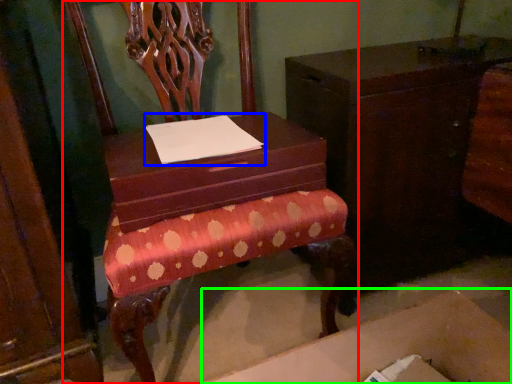
Question: Considering the real-world distances, which object is farthest from chair (highlighted by a red box)? notepad (highlighted by a blue box) or cardboard box (highlighted by a green box)?

Choices:
 (A) notepad
 (B) cardboard box

Answer: (B)